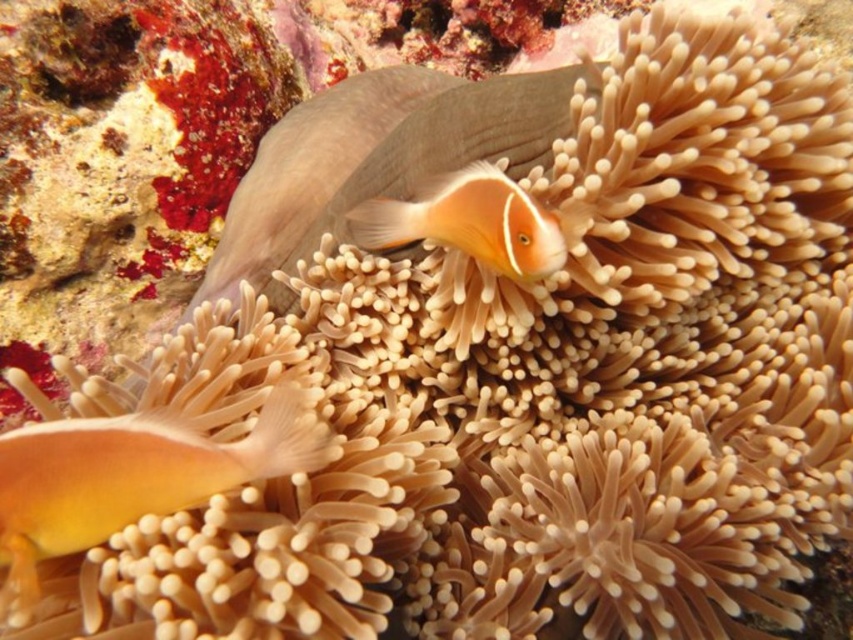
Is the position of translucent orange fish at lower left less distant than that of orange matte clownfish at center?

Yes.

Is translucent orange fish at lower left to the left of orange matte clownfish at center from the viewer's perspective?

Yes, translucent orange fish at lower left is to the left of orange matte clownfish at center.

Does point (61, 464) come in front of point (419, 209)?

Yes, it is in front of point (419, 209).

The height and width of the screenshot is (640, 853). I want to click on translucent orange fish at lower left, so click(132, 476).

Does orange matte fish at center have a lesser height compared to translucent orange fish at lower left?

Incorrect, orange matte fish at center's height does not fall short of translucent orange fish at lower left's.

Is point (383, 173) closer to viewer compared to point (62, 476)?

No, (383, 173) is further to viewer.

This screenshot has height=640, width=853. Identify the location of orange matte fish at center. (375, 157).

Is orange matte fish at center shorter than orange matte clownfish at center?

In fact, orange matte fish at center may be taller than orange matte clownfish at center.

Is orange matte fish at center to the left of orange matte clownfish at center from the viewer's perspective?

Yes, orange matte fish at center is to the left of orange matte clownfish at center.

This screenshot has height=640, width=853. What are the coordinates of `orange matte fish at center` in the screenshot? It's located at (375, 157).

Where is `orange matte fish at center`? This screenshot has width=853, height=640. orange matte fish at center is located at coordinates (375, 157).